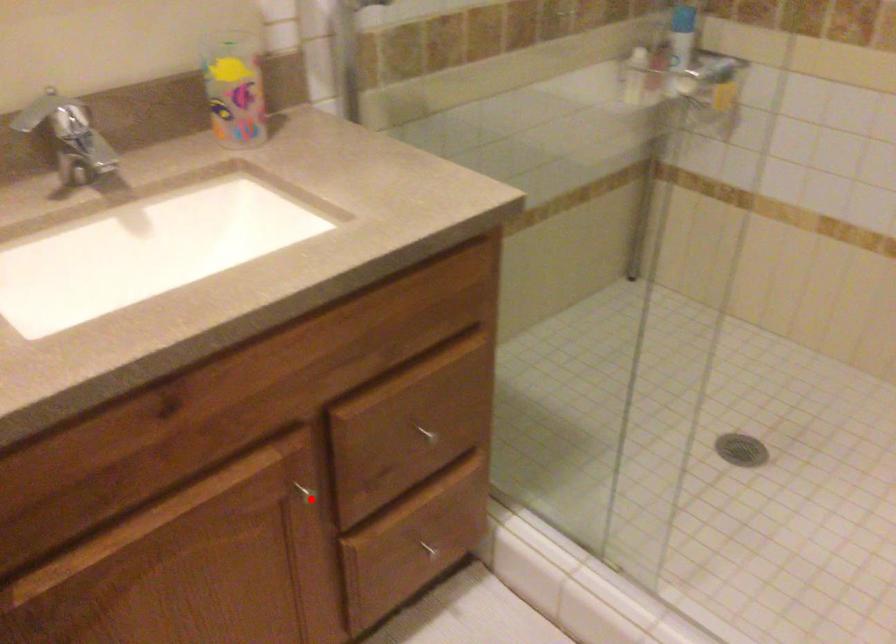
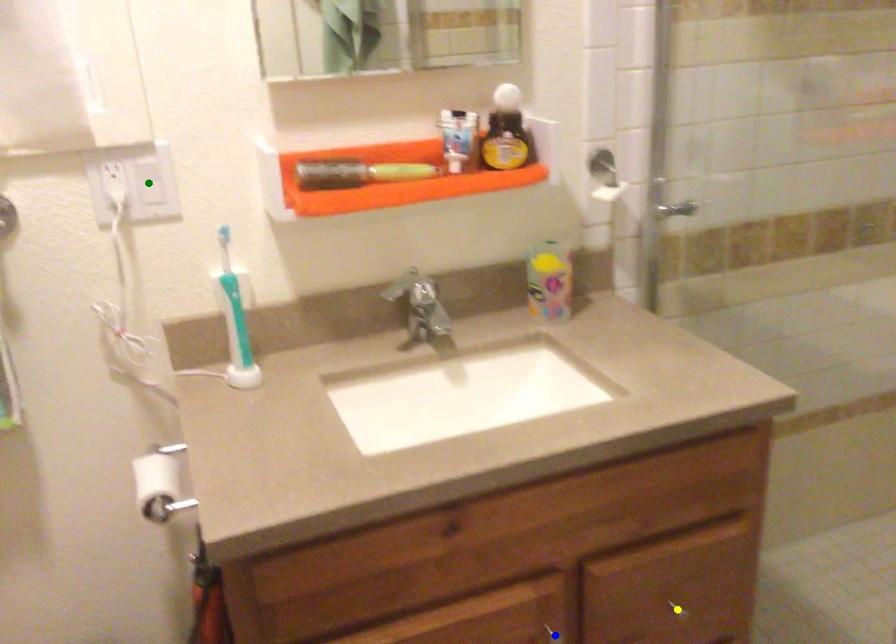
Question: I am providing you with two images of the same scene from different viewpoints. A red point is marked on the first image. You are given multiple points on the second image. Which spot in image 2 lines up with the point in image 1?

Choices:
 (A) green point
 (B) yellow point
 (C) blue point

Answer: (C)